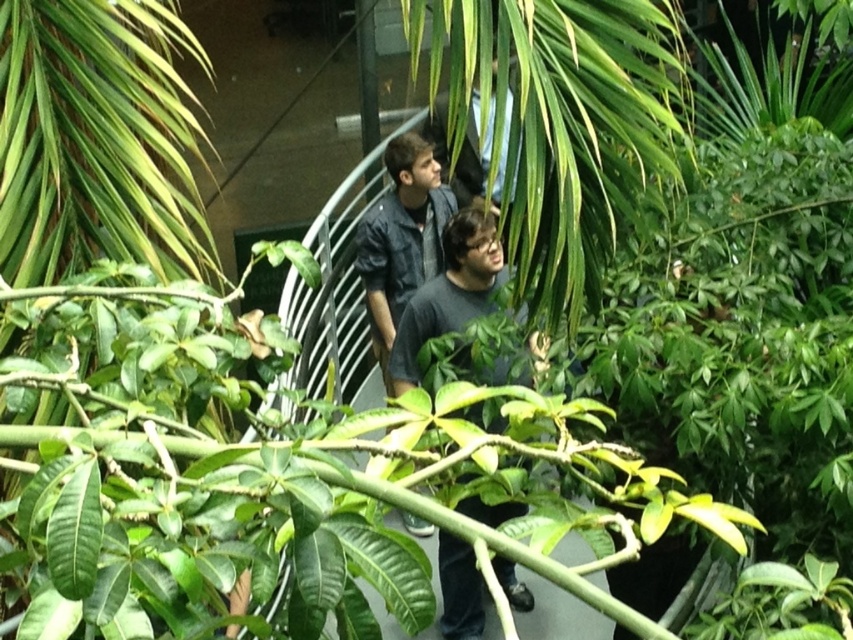
You are standing at the point with coordinates point (376, 214) and want to walk towards the point with coordinates point (450, 604). Given that the walkway curves gently, will you be walking in the same direction as the person in front wearing a dark gray T shirt and glasses?

Yes, since point (450, 604) is in front of point (376, 214), walking towards it means you are moving in the same direction as the person in front wearing a dark gray T shirt and glasses who is ahead on the walkway.

You are a photographer positioned at the end of the walkway. You want to capture a photo where both the dark gray shirt at center and the denim jacket at center are visible. Based on their positions, which one will appear closer to the bottom of the photo?

The dark gray shirt at center is below denim jacket at center, so it will appear closer to the bottom of the photo.

You are standing on the walkway and want to greet the person in the dark gray shirt at center and the person in the denim jacket at center. Which one should you approach first based on their positions?

You should approach the dark gray shirt at center first because it is closer to you than the denim jacket at center.